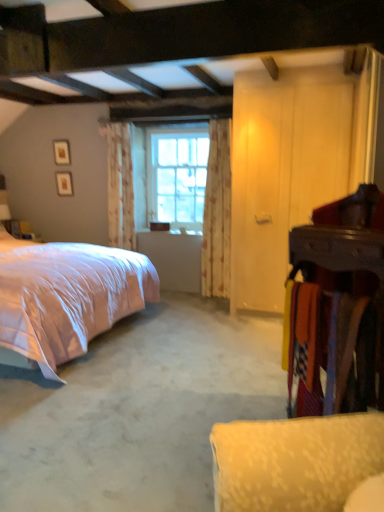
Where is `free space above white carpet at lower right (from a real-world perspective)`? This screenshot has width=384, height=512. free space above white carpet at lower right (from a real-world perspective) is located at coordinates coord(180,359).